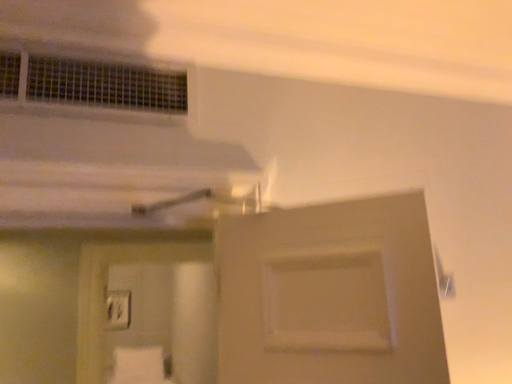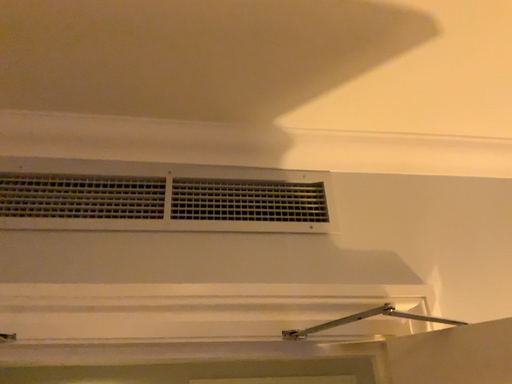
Question: Which way did the camera rotate in the video?

Choices:
 (A) rotated downward
 (B) rotated upward

Answer: (B)